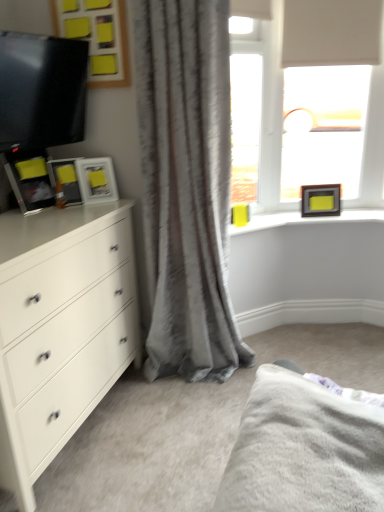
How much space does matte black picture frame at left, which is counted as the second picture frame, starting from the left, occupy horizontally?

matte black picture frame at left, which is counted as the second picture frame, starting from the left, is 4.29 inches in width.

Locate an element on the screen. white matte window at upper right is located at coordinates (282, 88).

What is the approximate height of white matte window at upper right?

It is 3.99 feet.

Describe the element at coordinates (65, 180) in the screenshot. I see `matte black picture frame at left, the 1th picture frame from the left` at that location.

Where is `white matte chest of drawers at left`? This screenshot has width=384, height=512. white matte chest of drawers at left is located at coordinates (58, 329).

Which of these two, matte black picture frame at upper right, placed as the first picture frame when sorted from back to front, or matte black picture frame at left, which appears as the 2th picture frame when viewed from the back, stands taller?

matte black picture frame at upper right, placed as the first picture frame when sorted from back to front, is taller.

Is matte black picture frame at upper right, which is the 3th picture frame from left to right, at the left side of matte black picture frame at left, which is the 2th picture frame from right to left?

In fact, matte black picture frame at upper right, which is the 3th picture frame from left to right, is to the right of matte black picture frame at left, which is the 2th picture frame from right to left.

In the scene shown: Measure the distance between matte black picture frame at upper right, which ranks as the 1th picture frame in right-to-left order, and matte black picture frame at left, which ranks as the second picture frame in front-to-back order.

The distance of matte black picture frame at upper right, which ranks as the 1th picture frame in right-to-left order, from matte black picture frame at left, which ranks as the second picture frame in front-to-back order, is 4.03 feet.

Is matte black picture frame at upper right, placed as the first picture frame when sorted from back to front, facing towards matte black picture frame at left, which appears as the 2th picture frame when viewed from the back?

No, matte black picture frame at upper right, placed as the first picture frame when sorted from back to front, is not aimed at matte black picture frame at left, which appears as the 2th picture frame when viewed from the back.

In terms of height, does matte black picture frame at upper right, placed as the first picture frame when sorted from back to front, look taller or shorter compared to fuzzy gray bed at lower right?

Clearly, matte black picture frame at upper right, placed as the first picture frame when sorted from back to front, is taller compared to fuzzy gray bed at lower right.

From the image's perspective, would you say matte black picture frame at upper right, the third picture frame positioned from the front, is shown under fuzzy gray bed at lower right?

Incorrect, from the image's perspective, matte black picture frame at upper right, the third picture frame positioned from the front, is higher than fuzzy gray bed at lower right.

At what (x,y) coordinates should I click in order to perform the action: click on bed frame below the matte black picture frame at upper right, which is the 3th picture frame from left to right (from a real-world perspective). Please return your answer as a coordinate pair (x, y). This screenshot has height=512, width=384. Looking at the image, I should click on (304, 449).

Are matte black picture frame at left, acting as the third picture frame starting from the right, and white matte chest of drawers at left located far from each other?

Actually, matte black picture frame at left, acting as the third picture frame starting from the right, and white matte chest of drawers at left are a little close together.

From a real-world perspective, is matte black picture frame at left, acting as the third picture frame starting from the right, positioned above or below white matte chest of drawers at left?

Clearly, from a real-world perspective, matte black picture frame at left, acting as the third picture frame starting from the right, is above white matte chest of drawers at left.

Between matte black picture frame at left, positioned as the 1th picture frame in front-to-back order, and white matte chest of drawers at left, which one has less height?

matte black picture frame at left, positioned as the 1th picture frame in front-to-back order, is shorter.

Is white matte chest of drawers at left in front of matte black picture frame at upper right, which ranks as the 1th picture frame in right-to-left order?

Yes, the depth of white matte chest of drawers at left is less than that of matte black picture frame at upper right, which ranks as the 1th picture frame in right-to-left order.

Is white matte chest of drawers at left oriented towards matte black picture frame at upper right, which ranks as the 1th picture frame in right-to-left order?

No.

From a real-world perspective, who is located lower, white matte chest of drawers at left or matte black picture frame at upper right, which ranks as the 1th picture frame in right-to-left order?

In real-world perspective, white matte chest of drawers at left is lower.

Could you measure the distance between white matte chest of drawers at left and matte black picture frame at upper right, the third picture frame positioned from the front?

white matte chest of drawers at left is 1.50 meters from matte black picture frame at upper right, the third picture frame positioned from the front.

How many degrees apart are the facing directions of gray textured curtain at center and white matte window at upper right?

There is a 15.4-degree angle between the facing directions of gray textured curtain at center and white matte window at upper right.

Is there a large distance between gray textured curtain at center and white matte window at upper right?

No, gray textured curtain at center is in close proximity to white matte window at upper right.

Does point (187, 89) come closer to viewer compared to point (275, 110)?

Yes, it is in front of point (275, 110).

Is gray textured curtain at center aimed at white matte window at upper right?

No, gray textured curtain at center is not aimed at white matte window at upper right.

Looking at the image, does fuzzy gray bed at lower right seem bigger or smaller compared to white matte chest of drawers at left?

Clearly, fuzzy gray bed at lower right is smaller in size than white matte chest of drawers at left.

Find the location of a particular element. The width and height of the screenshot is (384, 512). bed frame that is below the white matte chest of drawers at left (from the image's perspective) is located at coordinates (304, 449).

From the image's perspective, is fuzzy gray bed at lower right located beneath white matte chest of drawers at left?

Correct, fuzzy gray bed at lower right appears lower than white matte chest of drawers at left in the image.

From a real-world perspective, who is located higher, fuzzy gray bed at lower right or white matte chest of drawers at left?

fuzzy gray bed at lower right is physically above.

Is gray textured curtain at center positioned in front of matte black picture frame at left, which ranks as the second picture frame in front-to-back order?

Yes, the depth of gray textured curtain at center is less than that of matte black picture frame at left, which ranks as the second picture frame in front-to-back order.

Which of these two, gray textured curtain at center or matte black picture frame at left, which is the 2th picture frame from right to left, is smaller?

matte black picture frame at left, which is the 2th picture frame from right to left.

Considering the relative positions of gray textured curtain at center and matte black picture frame at left, which is the 2th picture frame from right to left, in the image provided, is gray textured curtain at center to the right of matte black picture frame at left, which is the 2th picture frame from right to left, from the viewer's perspective?

Correct, you'll find gray textured curtain at center to the right of matte black picture frame at left, which is the 2th picture frame from right to left.

Does point (216, 225) come in front of point (107, 175)?

Yes, it is in front of point (107, 175).

From a real-world perspective, count 2nd picture frames downward from the matte black picture frame at left, which appears as the 2th picture frame when viewed from the back, and point to it. Please provide its 2D coordinates.

[(320, 200)]

Locate an element on the screen. Image resolution: width=384 pixels, height=512 pixels. picture frame that is the 1st one above the fuzzy gray bed at lower right (from a real-world perspective) is located at coordinates 320,200.

Based on their spatial positions, is white matte chest of drawers at left or matte black picture frame at left, the 1th picture frame from the left, closer to white matte window at upper right?

The object closer to white matte window at upper right is matte black picture frame at left, the 1th picture frame from the left.

Estimate the real-world distances between objects in this image. Which object is further from gray textured curtain at center, white matte window at upper right or fuzzy gray bed at lower right?

fuzzy gray bed at lower right lies further to gray textured curtain at center than the other object.

When comparing their distances from matte black picture frame at left, which is the 2th picture frame from right to left, does fuzzy gray bed at lower right or white matte chest of drawers at left seem further?

fuzzy gray bed at lower right lies further to matte black picture frame at left, which is the 2th picture frame from right to left, than the other object.

From the image, which object appears to be farther from matte black picture frame at left, the 1th picture frame from the left, fuzzy gray bed at lower right or matte black picture frame at left, which ranks as the second picture frame in front-to-back order?

Among the two, fuzzy gray bed at lower right is located further to matte black picture frame at left, the 1th picture frame from the left.

Considering their positions, is gray textured curtain at center positioned closer to matte black picture frame at upper right, which is the 3th picture frame from left to right, than matte black picture frame at left, the 3th picture frame in the back-to-front sequence?

gray textured curtain at center is positioned closer to the anchor matte black picture frame at upper right, which is the 3th picture frame from left to right.

Based on their spatial positions, is matte black picture frame at upper right, which is the 3th picture frame from left to right, or gray textured curtain at center further from fuzzy gray bed at lower right?

matte black picture frame at upper right, which is the 3th picture frame from left to right.

Which object lies further to the anchor point matte black picture frame at upper right, which is the 3th picture frame from left to right, gray textured curtain at center or matte black picture frame at left, which ranks as the second picture frame in front-to-back order?

Based on the image, matte black picture frame at left, which ranks as the second picture frame in front-to-back order, appears to be further to matte black picture frame at upper right, which is the 3th picture frame from left to right.

When comparing their distances from white matte window at upper right, does white matte chest of drawers at left or matte black picture frame at left, which appears as the 2th picture frame when viewed from the back, seem closer?

matte black picture frame at left, which appears as the 2th picture frame when viewed from the back, lies closer to white matte window at upper right than the other object.

At what (x,y) coordinates should I click in order to perform the action: click on window positioned between gray textured curtain at center and matte black picture frame at upper right, which ranks as the 1th picture frame in right-to-left order, from near to far. Please return your answer as a coordinate pair (x, y). Looking at the image, I should click on (282, 88).

Where is `curtain between white matte chest of drawers at left and matte black picture frame at left, positioned as the 1th picture frame in front-to-back order, along the z-axis`? curtain between white matte chest of drawers at left and matte black picture frame at left, positioned as the 1th picture frame in front-to-back order, along the z-axis is located at coordinates (186, 186).

Locate an element on the screen. The height and width of the screenshot is (512, 384). curtain between matte black picture frame at left, acting as the third picture frame starting from the right, and matte black picture frame at upper right, which ranks as the 1th picture frame in right-to-left order, from left to right is located at coordinates (186, 186).

Where is `curtain between matte black picture frame at left, which appears as the 2th picture frame when viewed from the back, and white matte window at upper right`? curtain between matte black picture frame at left, which appears as the 2th picture frame when viewed from the back, and white matte window at upper right is located at coordinates (186, 186).